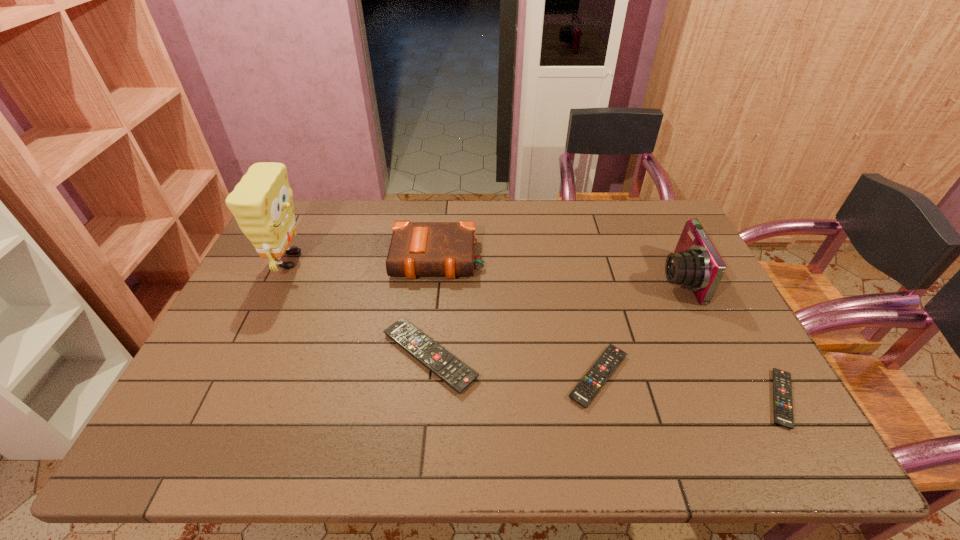
Image resolution: width=960 pixels, height=540 pixels. I want to click on unoccupied area between the rightmost remote control and the sponge, so click(536, 329).

Locate which object ranks second in proximity to the tallest object. Please provide its 2D coordinates. Your answer should be formatted as a tuple, i.e. [(x, y)], where the tuple contains the x and y coordinates of a point satisfying the conditions above.

[(451, 370)]

Choose which object is the second nearest neighbor to the leftmost remote control. Please provide its 2D coordinates. Your answer should be formatted as a tuple, i.e. [(x, y)], where the tuple contains the x and y coordinates of a point satisfying the conditions above.

[(587, 388)]

At what (x,y) coordinates should I click in order to perform the action: click on remote control that can be found as the second closest to the fifth tallest object. Please return your answer as a coordinate pair (x, y). The image size is (960, 540). Looking at the image, I should click on (782, 388).

You are a GUI agent. You are given a task and a screenshot of the screen. Output one action in this format:
    pyautogui.click(x=<x>, y=<y>)
    Task: Click on the remote control that is the third closest to the Bible
    This screenshot has height=540, width=960.
    Given the screenshot: What is the action you would take?
    pyautogui.click(x=782, y=388)

I want to click on free space that satisfies the following two spatial constraints: 1. on the spine side of the fourth shortest object; 2. on the right side of the rightmost object, so click(x=423, y=399).

Identify the location of free space that satisfies the following two spatial constraints: 1. on the face of the shortest object; 2. on the right side of the leftmost object. This screenshot has width=960, height=540. point(223,399).

The image size is (960, 540). In order to click on free space that satisfies the following two spatial constraints: 1. on the face of the tallest object; 2. on the back side of the second tallest remote control in this screenshot , I will do `click(233, 376)`.

The image size is (960, 540). Identify the location of vacant space that satisfies the following two spatial constraints: 1. on the front-facing side of the shortest remote control; 2. on the right side of the fifth shortest object. (735, 399).

Identify the location of vacant space that satisfies the following two spatial constraints: 1. on the front-facing side of the camera; 2. on the front side of the tallest remote control. This screenshot has height=540, width=960. (715, 356).